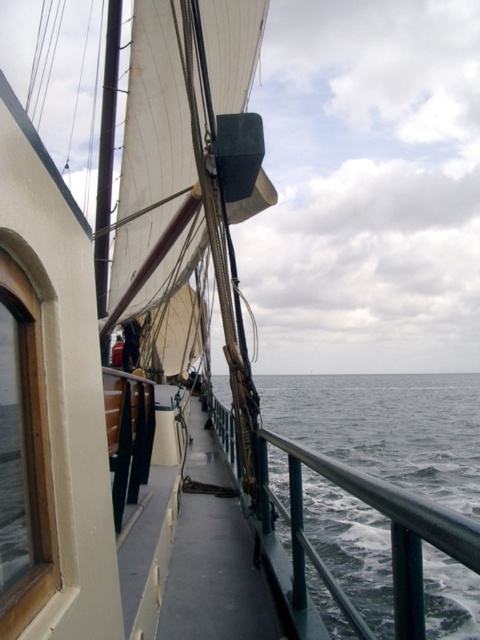
You are a sailor on the deck of the ship and need to determine the best place to secure a new rope. Considering the gray matte water at center and the dark blue fabric at center, which object has a wider horizontal span? Please explain your reasoning based on the scene.

The gray matte water at center has a larger width than the dark blue fabric at center, making it the wider object horizontally. This means the gray matte water at center occupies more horizontal space on the deck, so securing the rope there might be more feasible if a wider area is needed.

You are standing on the deck of the ship and want to look at the gray matte water at center and the dark blue fabric at center. Which object is closer to you?

The gray matte water at center is closer to you because it is in front of the dark blue fabric at center.

You are standing on the deck of the ship and see the gray matte water at center and the dark blue fabric at center. Which object is positioned lower from your viewpoint?

The gray matte water at center is located below the dark blue fabric at center, so it is positioned lower from your viewpoint.